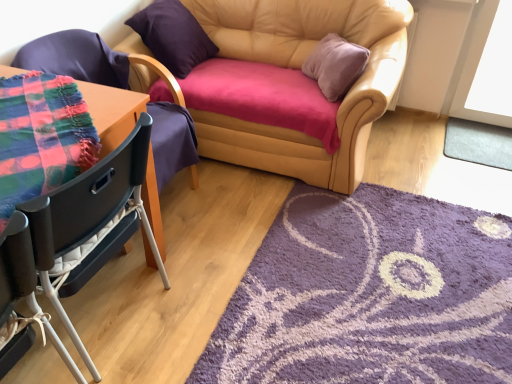
Question: From the image's perspective, relative to black plastic chair at left, placed as the second chair when sorted from back to front, is gray soft mat at lower right, the second mat when ordered from front to back, above or below?

Choices:
 (A) above
 (B) below

Answer: (A)

Question: Is gray soft mat at lower right, the first mat viewed from the top, taller or shorter than black plastic chair at left, arranged as the 2th chair when viewed from the front?

Choices:
 (A) short
 (B) tall

Answer: (A)

Question: Estimate the real-world distances between objects in this image. Which object is farther from the purple shaggy rug at lower right, marked as the first mat in a front-to-back arrangement?

Choices:
 (A) purple suede pillow at upper left
 (B) matte black chair at left, the 3th chair viewed from the front
 (C) leather couch at center
 (D) gray soft mat at lower right, the first mat viewed from the back
 (E) black plastic chair at left, placed as the second chair when sorted from back to front

Answer: (A)

Question: Which of these objects is positioned farthest from the purple suede pillow at upper left?

Choices:
 (A) purple shaggy rug at lower right, marked as the first mat in a front-to-back arrangement
 (B) black plastic chair at left, placed as the second chair when sorted from back to front
 (C) matte black chair at left, the 3th chair viewed from the front
 (D) white plastic chair at lower left, the third chair from the back
 (E) gray soft mat at lower right, the first mat viewed from the top

Answer: (E)